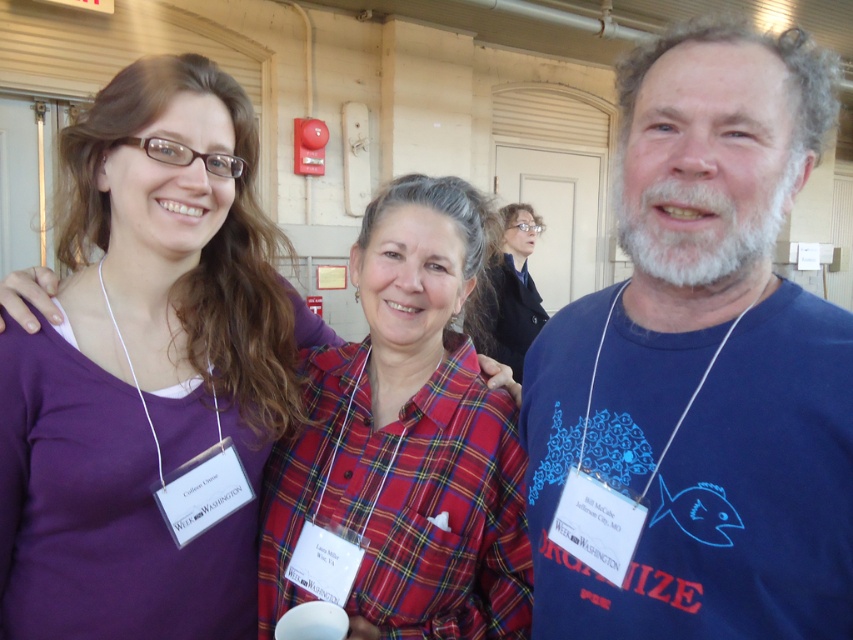
Is point (656, 513) farther from viewer compared to point (527, 330)?

No, (656, 513) is in front of (527, 330).

Can you confirm if blue cotton t-shirt at center is thinner than plaid fabric shirt at center?

Correct, blue cotton t-shirt at center's width is less than plaid fabric shirt at center's.

I want to click on blue cotton t-shirt at center, so click(x=703, y=362).

Is the position of purple fabric shirt at upper left more distant than that of plaid fabric shirt at center?

No, purple fabric shirt at upper left is in front of plaid fabric shirt at center.

What do you see at coordinates (146, 371) in the screenshot? Image resolution: width=853 pixels, height=640 pixels. I see `purple fabric shirt at upper left` at bounding box center [146, 371].

Does point (119, 256) lie in front of point (482, 307)?

Yes, it is.

Where is `purple fabric shirt at upper left`? The image size is (853, 640). purple fabric shirt at upper left is located at coordinates (146, 371).

Who is lower down, blue cotton t-shirt at center or purple fabric shirt at upper left?

purple fabric shirt at upper left is below.

Which is more to the right, blue cotton t-shirt at center or purple fabric shirt at upper left?

blue cotton t-shirt at center

Is point (695, 436) farther from camera compared to point (113, 426)?

No.

Identify the location of blue cotton t-shirt at center. This screenshot has height=640, width=853. (703, 362).